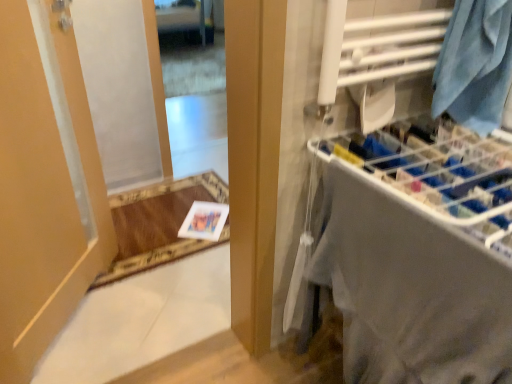
Question: Considering the positions of point (451, 92) and point (377, 102), is point (451, 92) closer or farther from the camera than point (377, 102)?

Choices:
 (A) farther
 (B) closer

Answer: (B)

Question: In terms of height, does blue fabric at upper right look taller or shorter compared to white fabric at right?

Choices:
 (A) short
 (B) tall

Answer: (A)

Question: Considering the real-world distances, which object is farthest from the clear glass mirror at upper center?

Choices:
 (A) white fabric at right
 (B) white paper at lower center
 (C) blue fabric at upper right
 (D) matte beige door at left

Answer: (C)

Question: Which object is the farthest from the white paper at lower center?

Choices:
 (A) clear glass mirror at upper center
 (B) blue fabric at upper right
 (C) white fabric at right
 (D) matte beige door at left

Answer: (B)